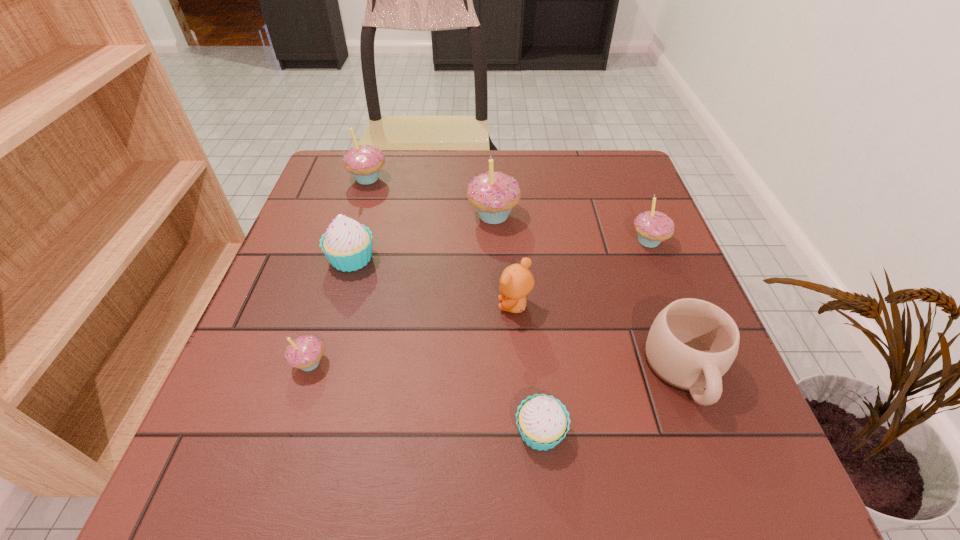
You are a GUI agent. You are given a task and a screenshot of the screen. Output one action in this format:
    pyautogui.click(x=<x>, y=<y>)
    Task: Click on the vacant space at the near edge of the desktop
    The image size is (960, 540).
    Given the screenshot: What is the action you would take?
    click(x=328, y=461)

The image size is (960, 540). In the image, there is a desktop. Identify the location of free space at the left edge. (314, 246).

This screenshot has height=540, width=960. In the image, there is a desktop. What are the coordinates of `free space at the right edge` in the screenshot? It's located at (612, 206).

You are a GUI agent. You are given a task and a screenshot of the screen. Output one action in this format:
    pyautogui.click(x=<x>, y=<y>)
    Task: Click on the free region at the near left corner of the desktop
    The height and width of the screenshot is (540, 960).
    Given the screenshot: What is the action you would take?
    pyautogui.click(x=235, y=506)

In the image, there is a desktop. Where is `free space at the near right corner`? free space at the near right corner is located at coordinates (692, 500).

Where is `vacant space that's between the rightmost cupcake and the nearest pink cupcake`? This screenshot has height=540, width=960. vacant space that's between the rightmost cupcake and the nearest pink cupcake is located at coordinates (479, 302).

In order to click on blank region between the brown teddy bear and the smallest pink cupcake in this screenshot , I will do `click(413, 334)`.

The height and width of the screenshot is (540, 960). What are the coordinates of `empty location between the mug and the fifth farthest cupcake` in the screenshot? It's located at (497, 367).

This screenshot has height=540, width=960. Identify the location of free space that is in between the mug and the rightmost cupcake. (666, 306).

Identify the location of free space between the right white cupcake and the bigger white cupcake. (446, 345).